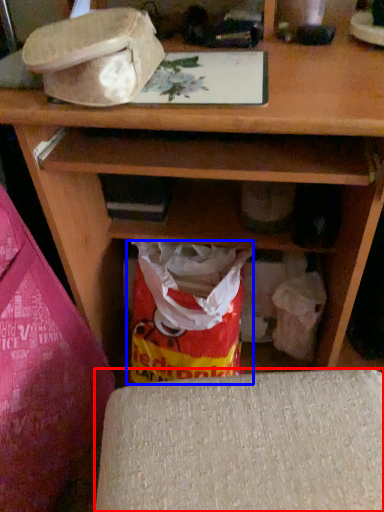
Question: Among these objects, which one is nearest to the camera, furniture (highlighted by a red box) or grocery bag (highlighted by a blue box)?

Choices:
 (A) furniture
 (B) grocery bag

Answer: (A)